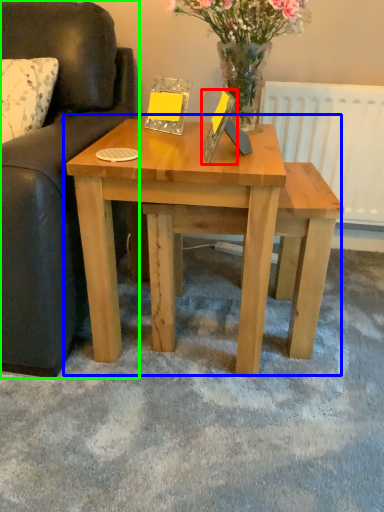
Question: Estimate the real-world distances between objects in this image. Which object is closer to picture frame (highlighted by a red box), coffee table (highlighted by a blue box) or studio couch (highlighted by a green box)?

Choices:
 (A) coffee table
 (B) studio couch

Answer: (A)